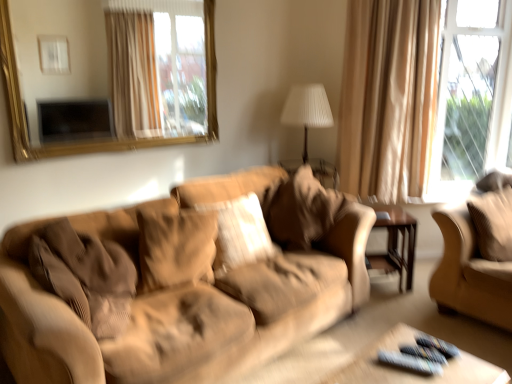
Question: Is gold-framed mirror at upper left behind brown wood side table at center right?

Choices:
 (A) yes
 (B) no

Answer: (B)

Question: Does gold-framed mirror at upper left have a larger size compared to brown wood side table at center right?

Choices:
 (A) no
 (B) yes

Answer: (B)

Question: From the image's perspective, would you say gold-framed mirror at upper left is positioned over brown wood side table at center right?

Choices:
 (A) yes
 (B) no

Answer: (A)

Question: Could you tell me if gold-framed mirror at upper left is facing brown wood side table at center right?

Choices:
 (A) yes
 (B) no

Answer: (B)

Question: Is gold-framed mirror at upper left far from brown wood side table at center right?

Choices:
 (A) no
 (B) yes

Answer: (B)

Question: From a real-world perspective, is gold-framed mirror at upper left under brown wood side table at center right?

Choices:
 (A) yes
 (B) no

Answer: (B)

Question: Is wooden remote control tray at lower right wider than suede-like beige pillow at center, acting as the third pillow starting from the left?

Choices:
 (A) no
 (B) yes

Answer: (A)

Question: Are wooden remote control tray at lower right and suede-like beige pillow at center, the second pillow viewed from the right, making contact?

Choices:
 (A) yes
 (B) no

Answer: (B)

Question: Is wooden remote control tray at lower right far from suede-like beige pillow at center, acting as the third pillow starting from the left?

Choices:
 (A) yes
 (B) no

Answer: (A)

Question: From the image's perspective, is wooden remote control tray at lower right under suede-like beige pillow at center, the second pillow viewed from the right?

Choices:
 (A) yes
 (B) no

Answer: (A)

Question: From a real-world perspective, is wooden remote control tray at lower right positioned over suede-like beige pillow at center, the second pillow viewed from the right, based on gravity?

Choices:
 (A) no
 (B) yes

Answer: (A)

Question: Can you confirm if wooden remote control tray at lower right is taller than suede-like beige pillow at center, acting as the third pillow starting from the left?

Choices:
 (A) yes
 (B) no

Answer: (B)

Question: Does corduroy pillow at right, arranged as the first pillow when viewed from the right, appear on the left side of suede-like beige pillow at center, which appears as the 3th pillow when viewed from the right?

Choices:
 (A) no
 (B) yes

Answer: (A)